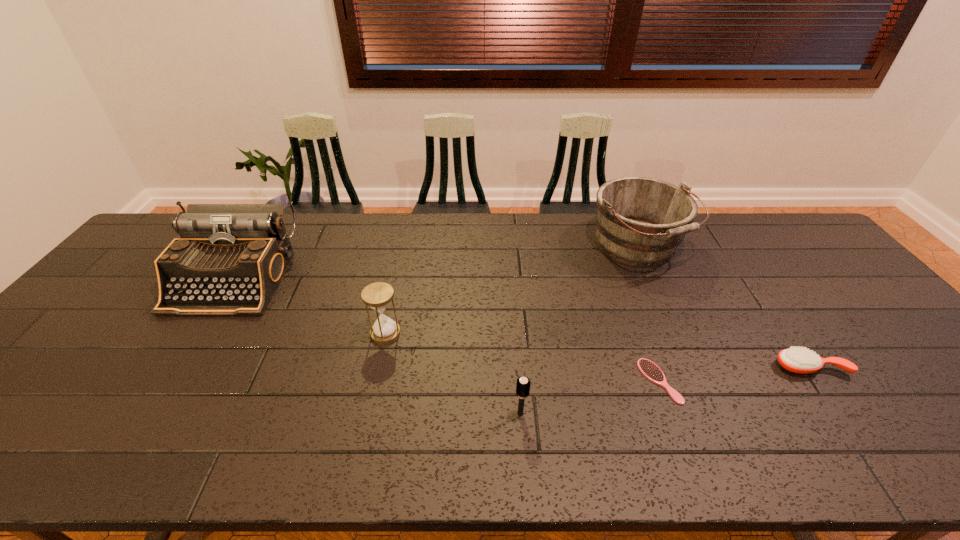
Locate an element on the screen. This screenshot has width=960, height=540. wine bucket is located at coordinates (640, 221).

The height and width of the screenshot is (540, 960). I want to click on typewriter, so click(x=229, y=259).

Where is `the second object from left to right`? The height and width of the screenshot is (540, 960). the second object from left to right is located at coordinates (378, 295).

At what (x,y) coordinates should I click in order to perform the action: click on hourglass. Please return your answer as a coordinate pair (x, y). Looking at the image, I should click on (378, 295).

Locate an element on the screen. This screenshot has height=540, width=960. the nearest object is located at coordinates point(523,384).

Locate an element on the screen. the fourth object from right to left is located at coordinates click(523, 384).

At what (x,y) coordinates should I click in order to perform the action: click on the rightmost object. Please return your answer as a coordinate pair (x, y). Image resolution: width=960 pixels, height=540 pixels. Looking at the image, I should click on (796, 360).

Locate an element on the screen. the second shortest hairbrush is located at coordinates (796, 360).

Where is `the shortest hairbrush`? the shortest hairbrush is located at coordinates (650, 370).

This screenshot has height=540, width=960. What are the coordinates of `the second hairbrush from right to left` in the screenshot? It's located at (650, 370).